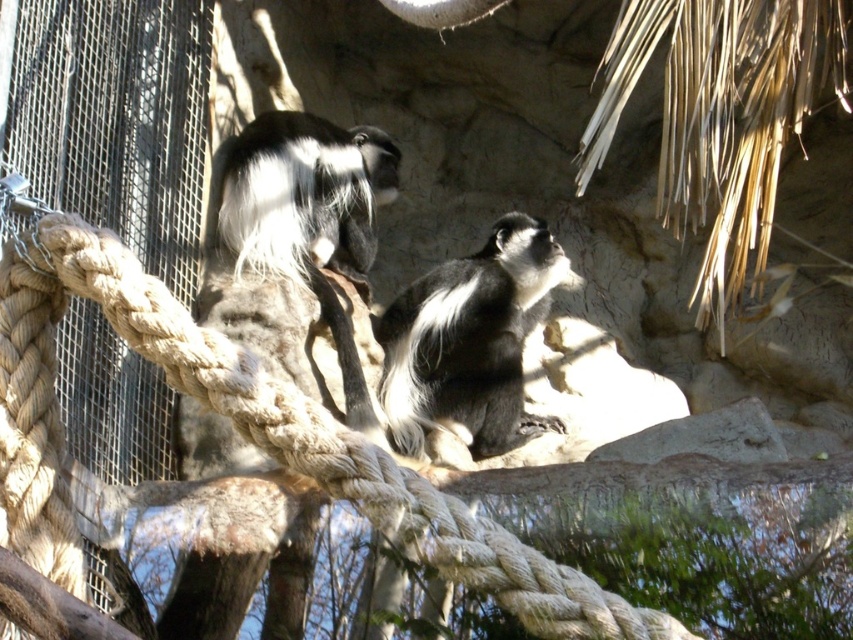
What do you see at coordinates (469, 342) in the screenshot? The height and width of the screenshot is (640, 853). I see `black and white fur monkey at center` at bounding box center [469, 342].

Does point (474, 378) come farther from viewer compared to point (253, 252)?

No, it is not.

Does point (412, 456) lie behind point (297, 141)?

No, (412, 456) is closer to viewer.

Identify the location of black and white fur monkey at center. This screenshot has width=853, height=640. (469, 342).